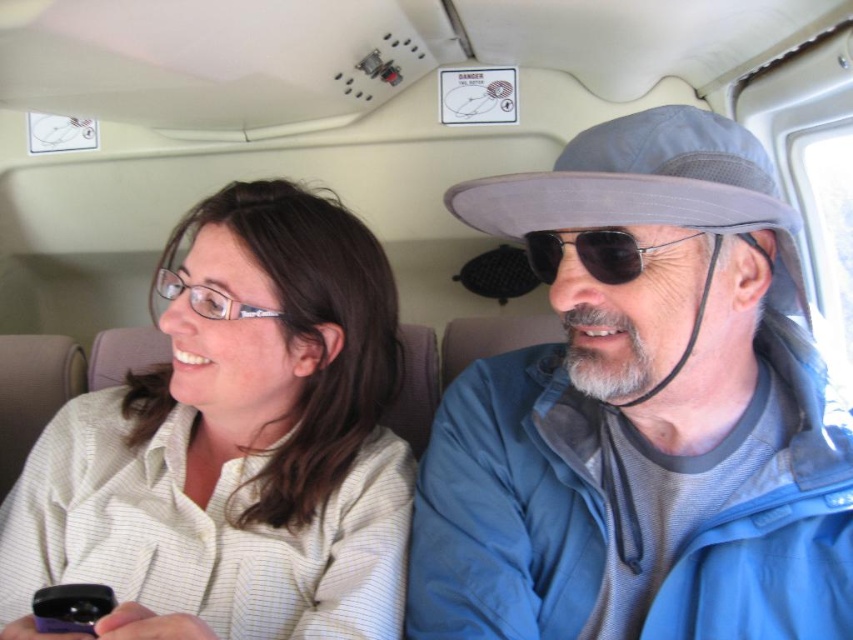
Between sunglasses at center and clear plastic glasses at upper left, which one has more height?

clear plastic glasses at upper left is taller.

Does sunglasses at center have a greater width compared to clear plastic glasses at upper left?

In fact, sunglasses at center might be narrower than clear plastic glasses at upper left.

This screenshot has height=640, width=853. Describe the element at coordinates (590, 253) in the screenshot. I see `sunglasses at center` at that location.

Locate an element on the screen. sunglasses at center is located at coordinates (590, 253).

Based on the photo, does blue fabric jacket at right have a lesser height compared to white striped shirt at center?

Correct, blue fabric jacket at right is not as tall as white striped shirt at center.

Does blue fabric jacket at right have a greater height compared to white striped shirt at center?

No, blue fabric jacket at right is not taller than white striped shirt at center.

Describe the element at coordinates (643, 416) in the screenshot. I see `blue fabric jacket at right` at that location.

Image resolution: width=853 pixels, height=640 pixels. Identify the location of blue fabric jacket at right. pyautogui.click(x=643, y=416).

Which is above, white striped shirt at center or clear plastic glasses at upper left?

clear plastic glasses at upper left is higher up.

What do you see at coordinates (235, 448) in the screenshot? I see `white striped shirt at center` at bounding box center [235, 448].

Between point (157, 612) and point (157, 291), which one is positioned in front?

Point (157, 612) is more forward.

This screenshot has width=853, height=640. I want to click on white striped shirt at center, so click(x=235, y=448).